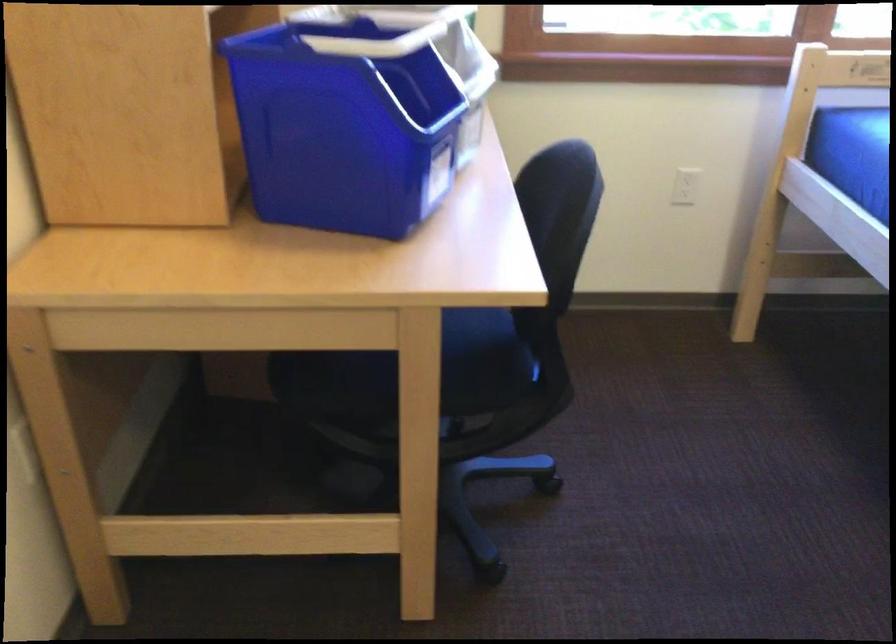
Where would you pull the white bin handle? Please return your answer as a coordinate pair (x, y).

(506, 26)